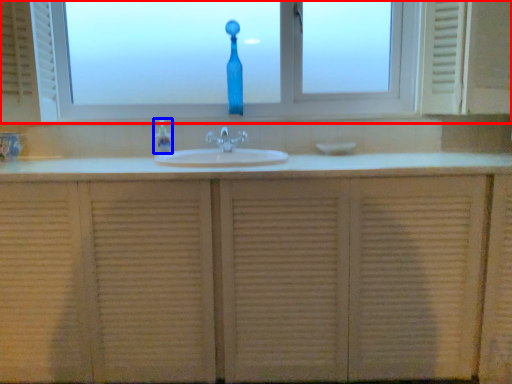
Question: Which point is further to the camera, window (highlighted by a red box) or soap dispenser (highlighted by a blue box)?

Choices:
 (A) window
 (B) soap dispenser

Answer: (A)